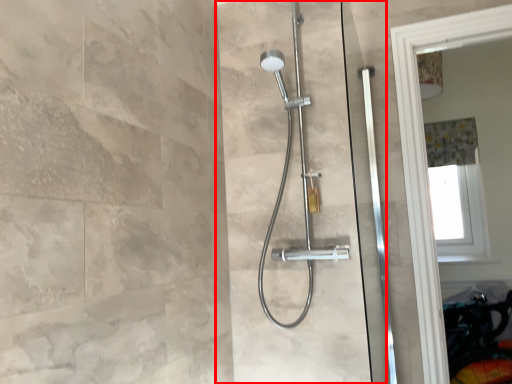
Question: From the image's perspective, considering the relative positions of screen door (annotated by the red box) and shower curtain in the image provided, where is screen door (annotated by the red box) located with respect to the staircase?

Choices:
 (A) above
 (B) below

Answer: (B)